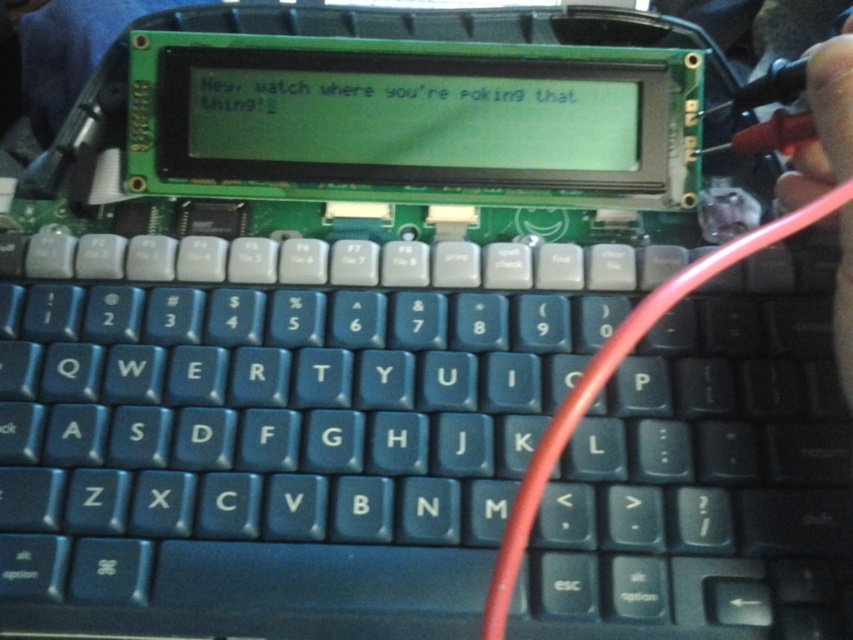
Question: Which object is farther from the camera taking this photo?

Choices:
 (A) red rubber cable at right
 (B) black plastic keyboard at center

Answer: (B)

Question: Is black plastic keyboard at center further to the viewer compared to red rubber cable at right?

Choices:
 (A) no
 (B) yes

Answer: (B)

Question: Which of the following is the closest to the observer?

Choices:
 (A) (461, 394)
 (B) (834, 196)

Answer: (B)

Question: Is black plastic keyboard at center below red rubber cable at right?

Choices:
 (A) yes
 (B) no

Answer: (A)

Question: Does black plastic keyboard at center appear on the left side of red rubber cable at right?

Choices:
 (A) no
 (B) yes

Answer: (B)